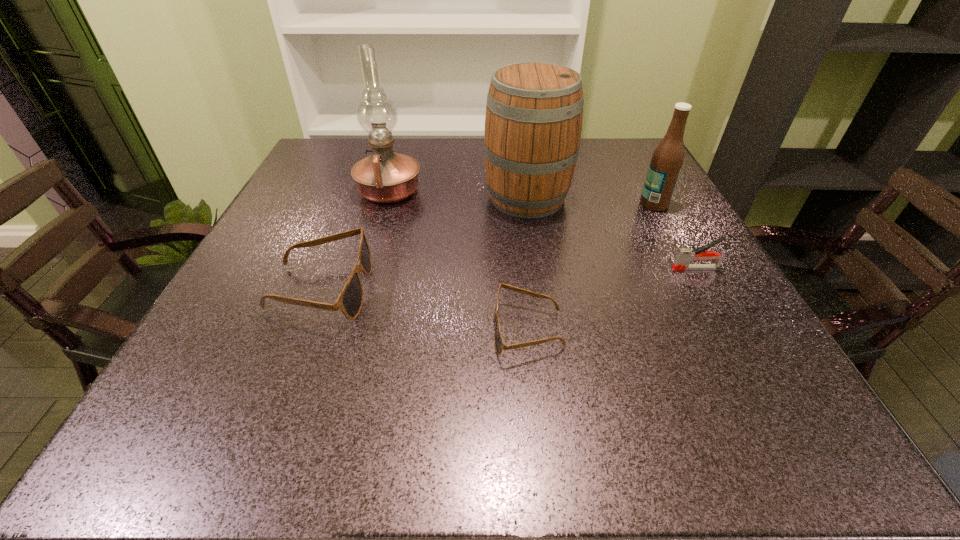
Identify the location of the taller sunglasses. The width and height of the screenshot is (960, 540). (350, 301).

The width and height of the screenshot is (960, 540). In order to click on the right sunglasses in this screenshot , I will do click(x=499, y=344).

The image size is (960, 540). I want to click on the shortest object, so click(499, 344).

You are a GUI agent. You are given a task and a screenshot of the screen. Output one action in this format:
    pyautogui.click(x=<x>, y=<y>)
    Task: Click on the cider
    The image size is (960, 540).
    Given the screenshot: What is the action you would take?
    pyautogui.click(x=533, y=123)

In order to click on oil lamp in this screenshot , I will do `click(385, 176)`.

I want to click on beer bottle, so click(x=667, y=159).

In order to click on stapler in this screenshot , I will do `click(684, 256)`.

The width and height of the screenshot is (960, 540). In order to click on vacant area situated 0.070m on the frames of the left sunglasses in this screenshot , I will do `click(405, 288)`.

Image resolution: width=960 pixels, height=540 pixels. Identify the location of vacant area situated on the frames of the right sunglasses. click(278, 330).

Find the location of a particular element. Image resolution: width=960 pixels, height=540 pixels. vacant position located on the frames of the right sunglasses is located at coordinates (321, 330).